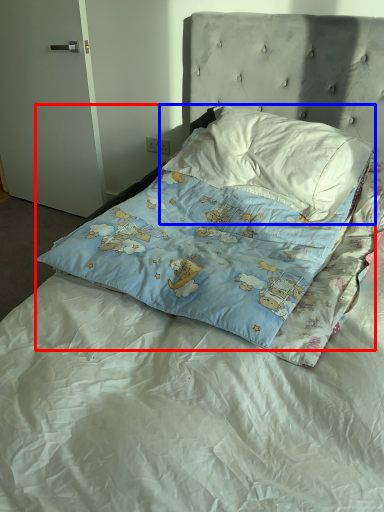
Question: Among these objects, which one is nearest to the camera, pillow (highlighted by a red box) or pillow (highlighted by a blue box)?

Choices:
 (A) pillow
 (B) pillow

Answer: (A)